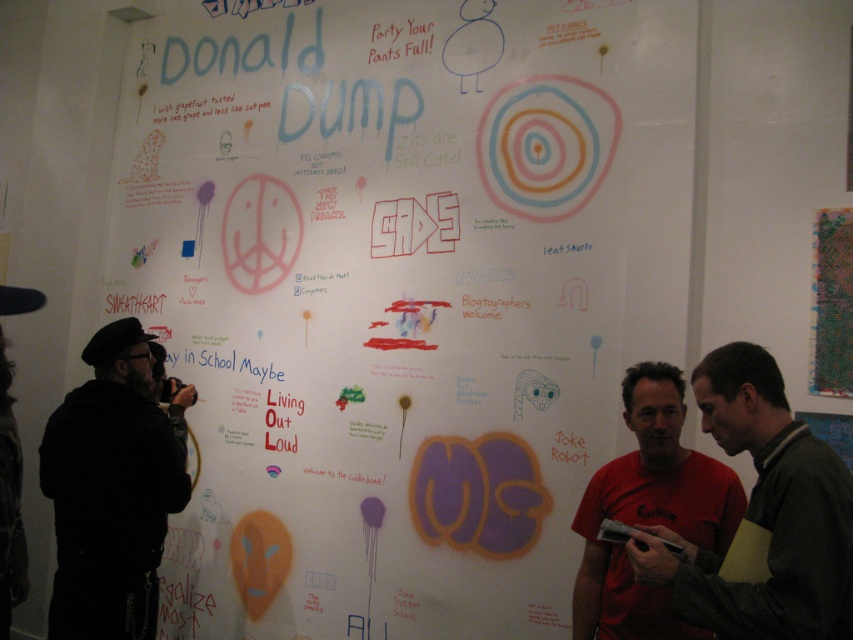
Question: Is matte black shirt at center positioned at the back of black matte jacket at left?

Choices:
 (A) no
 (B) yes

Answer: (A)

Question: Which point is farther to the camera?

Choices:
 (A) matte black shirt at center
 (B) black matte jacket at left
 (C) red matte t-shirt at center
 (D) white paper poster at center

Answer: (D)

Question: Among these objects, which one is nearest to the camera?

Choices:
 (A) red matte t-shirt at center
 (B) black matte jacket at left
 (C) matte black shirt at center

Answer: (C)

Question: Does white paper poster at center have a greater width compared to matte black shirt at center?

Choices:
 (A) no
 (B) yes

Answer: (B)

Question: Among these objects, which one is nearest to the camera?

Choices:
 (A) red matte t-shirt at center
 (B) black matte jacket at left
 (C) matte black shirt at center
 (D) white paper poster at center

Answer: (C)

Question: Can you confirm if matte black shirt at center is positioned to the left of black matte jacket at left?

Choices:
 (A) no
 (B) yes

Answer: (A)